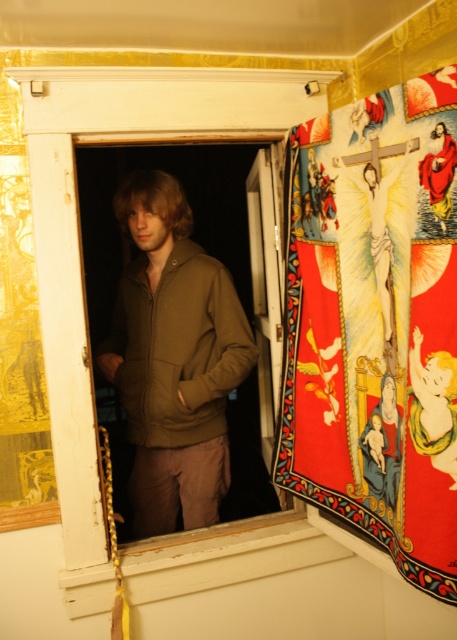
Question: Among these points, which one is nearest to the camera?

Choices:
 (A) click(x=149, y=273)
 (B) click(x=415, y=524)

Answer: (B)

Question: Can you confirm if vibrant fabric tapestry at right is positioned to the right of matte olive-green hoodie at center?

Choices:
 (A) yes
 (B) no

Answer: (A)

Question: Considering the relative positions of vibrant fabric tapestry at right and matte olive-green hoodie at center in the image provided, where is vibrant fabric tapestry at right located with respect to matte olive-green hoodie at center?

Choices:
 (A) below
 (B) above

Answer: (B)

Question: Can you confirm if vibrant fabric tapestry at right is wider than matte olive-green hoodie at center?

Choices:
 (A) yes
 (B) no

Answer: (B)

Question: Which of the following is the farthest from the observer?

Choices:
 (A) (200, 268)
 (B) (344, 264)

Answer: (A)

Question: Which point is closer to the camera taking this photo?

Choices:
 (A) (313, 170)
 (B) (173, 413)

Answer: (A)